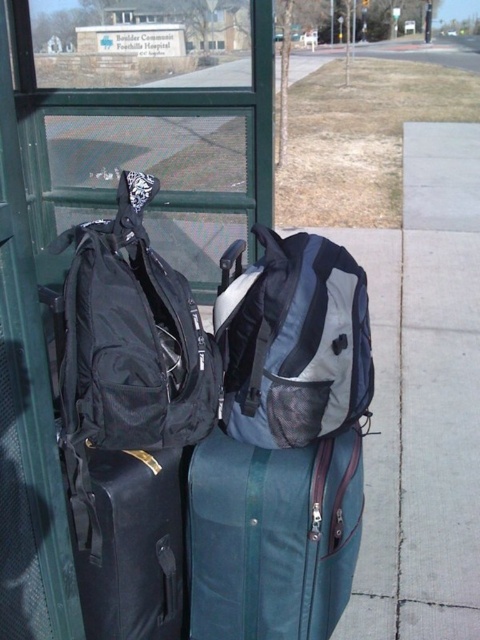
Does black fabric backpack at left have a greater width compared to matte black backpack at left?

Yes.

Between black fabric backpack at left and matte black backpack at left, which one appears on the left side from the viewer's perspective?

black fabric backpack at left is more to the left.

Describe the element at coordinates (132, 337) in the screenshot. The image size is (480, 640). I see `black fabric backpack at left` at that location.

This screenshot has width=480, height=640. Identify the location of black fabric backpack at left. (132, 337).

Does teal fabric suitcase at center appear over black fabric backpack at left?

No.

Between point (344, 608) and point (106, 225), which one is positioned behind?

The point (344, 608) is more distant.

Locate an element on the screen. The width and height of the screenshot is (480, 640). teal fabric suitcase at center is located at coordinates (273, 538).

Can you confirm if teal fabric suitcase at center is positioned to the right of gray fabric backpack at center?

Incorrect, teal fabric suitcase at center is not on the right side of gray fabric backpack at center.

Who is more forward, (216, 536) or (232, 288)?

Point (216, 536) is more forward.

Find the location of a particular element. Image resolution: width=480 pixels, height=640 pixels. teal fabric suitcase at center is located at coordinates (273, 538).